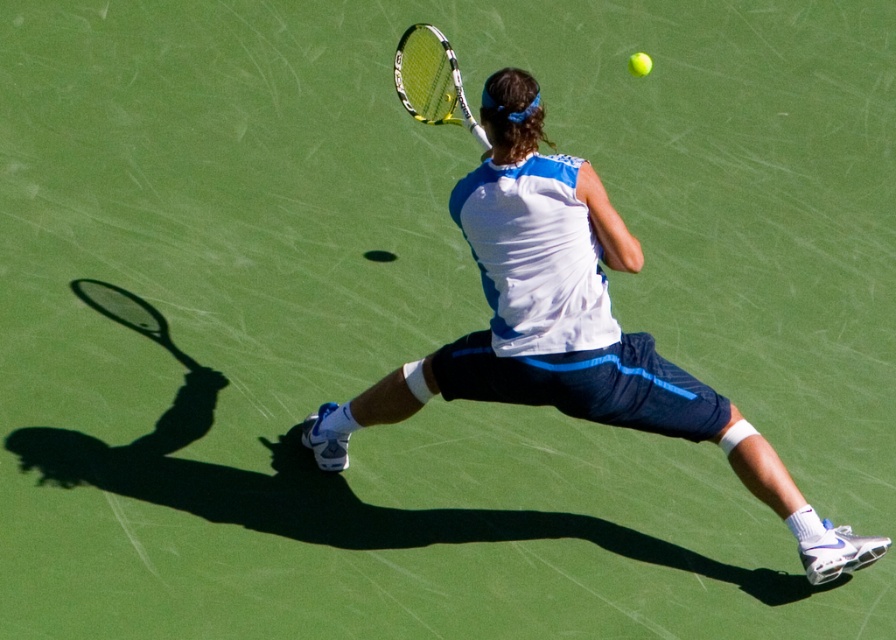
Question: Is the position of yellow-green composite tennis racket at center more distant than that of green matte tennis ball at upper right?

Choices:
 (A) yes
 (B) no

Answer: (B)

Question: Considering the relative positions of yellow-green composite tennis racket at center and green matte tennis ball at upper right in the image provided, where is yellow-green composite tennis racket at center located with respect to green matte tennis ball at upper right?

Choices:
 (A) below
 (B) above

Answer: (A)

Question: Does yellow-green composite tennis racket at center have a smaller size compared to green matte tennis ball at upper right?

Choices:
 (A) no
 (B) yes

Answer: (A)

Question: Which object is farther from the camera taking this photo?

Choices:
 (A) yellow-green composite tennis racket at center
 (B) green matte tennis ball at upper right

Answer: (B)

Question: Among these points, which one is nearest to the camera?

Choices:
 (A) (642, 61)
 (B) (414, 83)

Answer: (B)